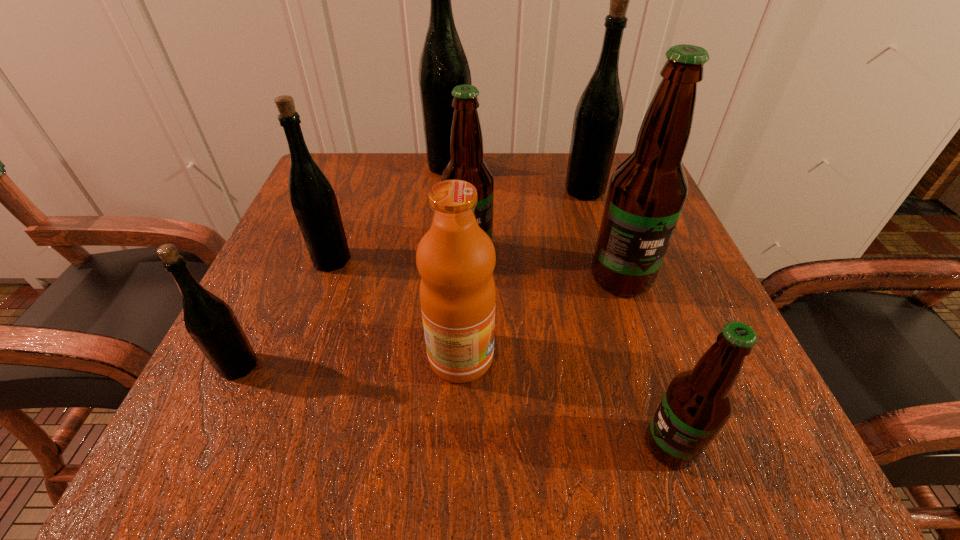
Identify the location of vacant space located on the label of the nearest beer bottle. (358, 446).

You are a GUI agent. You are given a task and a screenshot of the screen. Output one action in this format:
    pyautogui.click(x=<x>, y=<y>)
    Task: Click on the free space located 0.070m on the label of the nearest beer bottle
    This screenshot has width=960, height=540.
    Given the screenshot: What is the action you would take?
    pyautogui.click(x=588, y=446)

Identify the location of vacant area located on the label of the nearest beer bottle. The image size is (960, 540). (517, 446).

Locate an element on the screen. This screenshot has height=540, width=960. object positioned at the near edge is located at coordinates (698, 402).

This screenshot has height=540, width=960. Identify the location of object that is at the far right corner. (598, 117).

Locate an element on the screen. The height and width of the screenshot is (540, 960). object that is at the near right corner is located at coordinates (698, 402).

Find the location of a particular element. free spot at the far edge of the desktop is located at coordinates (404, 179).

At what (x,y) coordinates should I click in order to perform the action: click on vacant point at the left edge. Please return your answer as a coordinate pair (x, y). The width and height of the screenshot is (960, 540). Looking at the image, I should click on (252, 316).

This screenshot has height=540, width=960. In the image, there is a desktop. What are the coordinates of `free space at the right edge` in the screenshot? It's located at (630, 299).

At what (x,y) coordinates should I click in order to perform the action: click on free spot at the far left corner of the desktop. Please return your answer as a coordinate pair (x, y). Image resolution: width=960 pixels, height=540 pixels. Looking at the image, I should click on (346, 179).